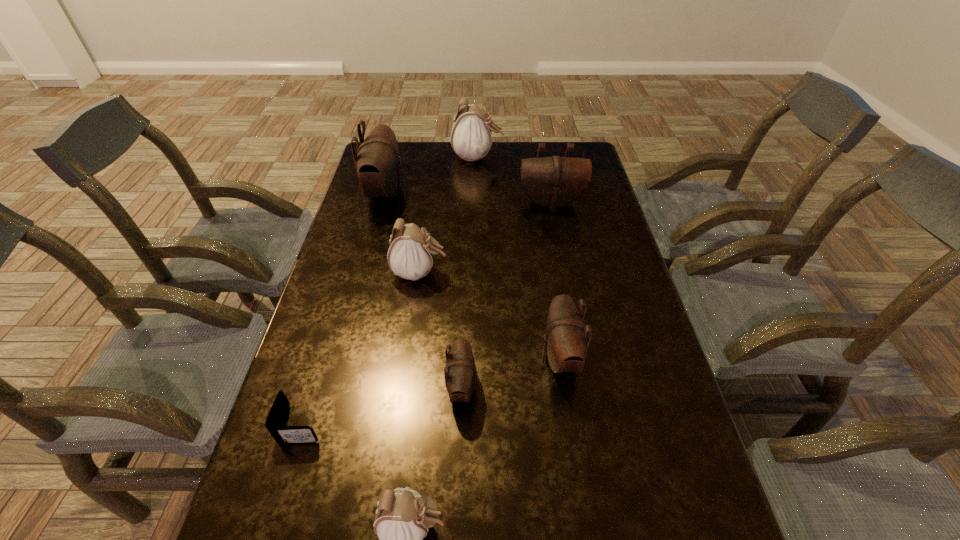
Identify the location of white pouch object that ranks as the second closest to the third biggest brown pouch. (403, 516).

Select which white pouch is the third closest to the third brown pouch from right to left. Please provide its 2D coordinates. Your answer should be formatted as a tuple, i.e. [(x, y)], where the tuple contains the x and y coordinates of a point satisfying the conditions above.

[(471, 137)]